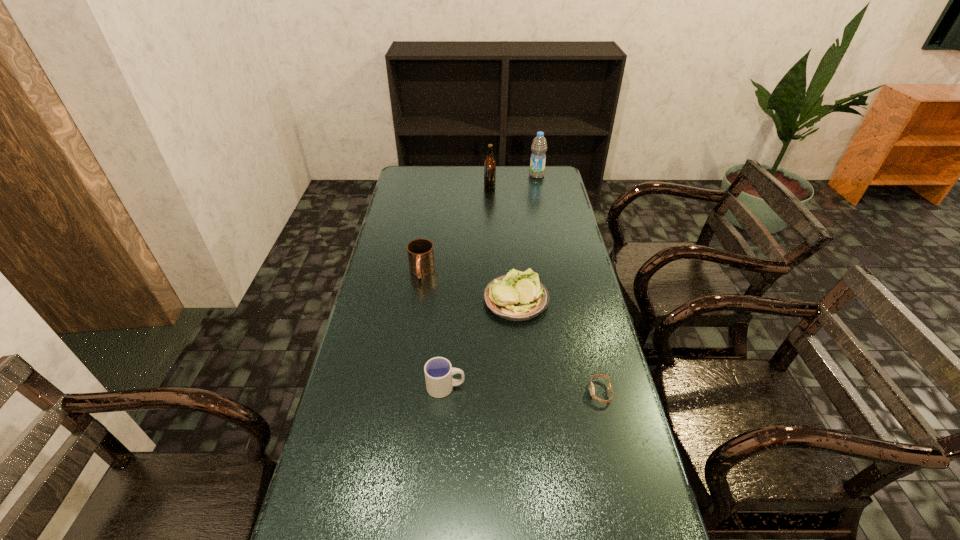
Identify the location of free space located 0.330m on the side of the leftmost object with the handle. This screenshot has height=540, width=960. (408, 361).

You are a GUI agent. You are given a task and a screenshot of the screen. Output one action in this format:
    pyautogui.click(x=<x>, y=<y>)
    Task: Click on the vacant space located 0.110m with the handle on the side of the fifth object from right to left
    
    Given the screenshot: What is the action you would take?
    pyautogui.click(x=505, y=387)

Image resolution: width=960 pixels, height=540 pixels. I want to click on blank space located on the right of the lettuce, so click(x=582, y=299).

At what (x,y) coordinates should I click in order to perform the action: click on free region located on the face of the shortest object. Please return your answer as a coordinate pair (x, y). Looking at the image, I should click on (523, 392).

Locate an element on the screen. This screenshot has width=960, height=540. free region located 0.390m on the face of the shortest object is located at coordinates (445, 392).

The width and height of the screenshot is (960, 540). Find the location of `free region located 0.320m on the face of the shortest object`. free region located 0.320m on the face of the shortest object is located at coordinates (471, 392).

Locate an element on the screen. The height and width of the screenshot is (540, 960). water bottle present at the far edge is located at coordinates (539, 146).

This screenshot has height=540, width=960. I want to click on beer bottle present at the far edge, so click(489, 164).

Locate an element on the screen. object present at the left edge is located at coordinates (420, 252).

Locate an element on the screen. water bottle that is at the right edge is located at coordinates (539, 146).